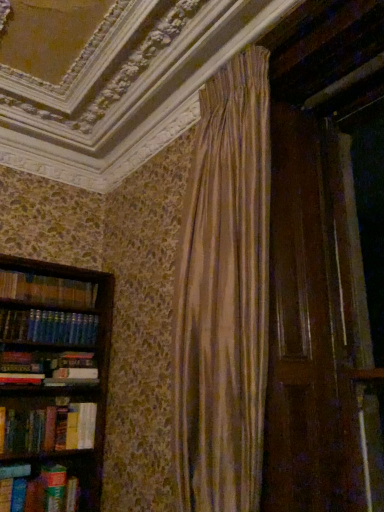
The width and height of the screenshot is (384, 512). What do you see at coordinates (41, 489) in the screenshot?
I see `hardcover book at left` at bounding box center [41, 489].

At what (x,y) coordinates should I click in order to perform the action: click on hardcover book at left. Please return your answer as a coordinate pair (x, y). Looking at the image, I should click on (41, 489).

Find the location of a particular element. The width and height of the screenshot is (384, 512). green matte paperback book at lower left is located at coordinates (54, 487).

Describe the element at coordinates (54, 487) in the screenshot. I see `green matte paperback book at lower left` at that location.

The image size is (384, 512). Identify the location of hardcover book at left. (41, 489).

Is green matte paperback book at lower left at the right side of hardcover book at left?

Indeed, green matte paperback book at lower left is positioned on the right side of hardcover book at left.

Considering the relative positions of green matte paperback book at lower left and hardcover book at left in the image provided, is green matte paperback book at lower left behind hardcover book at left?

Yes, green matte paperback book at lower left is further from the viewer.

Is point (56, 498) farther from camera compared to point (67, 492)?

No, (56, 498) is in front of (67, 492).

From the image's perspective, which one is positioned lower, green matte paperback book at lower left or hardcover book at left?

From the image's view, green matte paperback book at lower left is below.

From a real-world perspective, is green matte paperback book at lower left under hardcover book at left?

No, from a real-world perspective, green matte paperback book at lower left is not below hardcover book at left.

Considering the relative sizes of green matte paperback book at lower left and hardcover book at left in the image provided, is green matte paperback book at lower left thinner than hardcover book at left?

No.

Which of these two, green matte paperback book at lower left or hardcover book at left, stands taller?

green matte paperback book at lower left is taller.

Who is smaller, green matte paperback book at lower left or hardcover book at left?

Smaller between the two is green matte paperback book at lower left.

Is green matte paperback book at lower left outside of hardcover book at left?

Yes, green matte paperback book at lower left is outside of hardcover book at left.

Is green matte paperback book at lower left far away from hardcover book at left?

No, green matte paperback book at lower left is in close proximity to hardcover book at left.

Could you tell me if green matte paperback book at lower left is turned towards hardcover book at left?

No, green matte paperback book at lower left does not turn towards hardcover book at left.

Where is `book on the left of green matte paperback book at lower left`? The width and height of the screenshot is (384, 512). book on the left of green matte paperback book at lower left is located at coordinates (41, 489).

Between hardcover book at left and green matte paperback book at lower left, which one appears on the left side from the viewer's perspective?

Positioned to the left is hardcover book at left.

Is the position of hardcover book at left more distant than that of green matte paperback book at lower left?

No, it is in front of green matte paperback book at lower left.

Between point (32, 483) and point (52, 490), which one is positioned behind?

The point (52, 490) is farther from the camera.

From the image's perspective, between hardcover book at left and green matte paperback book at lower left, which one is located above?

hardcover book at left.

From a real-world perspective, which object rests below the other?

hardcover book at left.

Between hardcover book at left and green matte paperback book at lower left, which one has smaller width?

Thinner between the two is hardcover book at left.

Is hardcover book at left taller or shorter than green matte paperback book at lower left?

Clearly, hardcover book at left is shorter compared to green matte paperback book at lower left.

Considering the relative sizes of hardcover book at left and green matte paperback book at lower left in the image provided, is hardcover book at left bigger than green matte paperback book at lower left?

Yes, hardcover book at left is bigger than green matte paperback book at lower left.

Would you say hardcover book at left is inside or outside green matte paperback book at lower left?

hardcover book at left is outside green matte paperback book at lower left.

Is hardcover book at left touching green matte paperback book at lower left?

Yes, hardcover book at left is in contact with green matte paperback book at lower left.

Is green matte paperback book at lower left at the back of hardcover book at left?

No, hardcover book at left is not facing the opposite direction of green matte paperback book at lower left.

How many degrees apart are the facing directions of hardcover book at left and green matte paperback book at lower left?

The angular difference between hardcover book at left and green matte paperback book at lower left is 0.000202 degrees.

Find the location of `book located above the green matte paperback book at lower left (from the image's perspective)`. book located above the green matte paperback book at lower left (from the image's perspective) is located at coordinates (41, 489).

Locate an element on the screen. This screenshot has height=512, width=384. book in front of the green matte paperback book at lower left is located at coordinates (41, 489).

The image size is (384, 512). I want to click on book that appears on the left of green matte paperback book at lower left, so click(x=41, y=489).